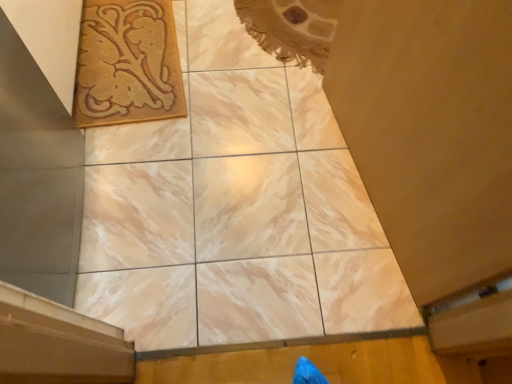
Find the location of `vacant space behind marble tile at center`. vacant space behind marble tile at center is located at coordinates (229, 145).